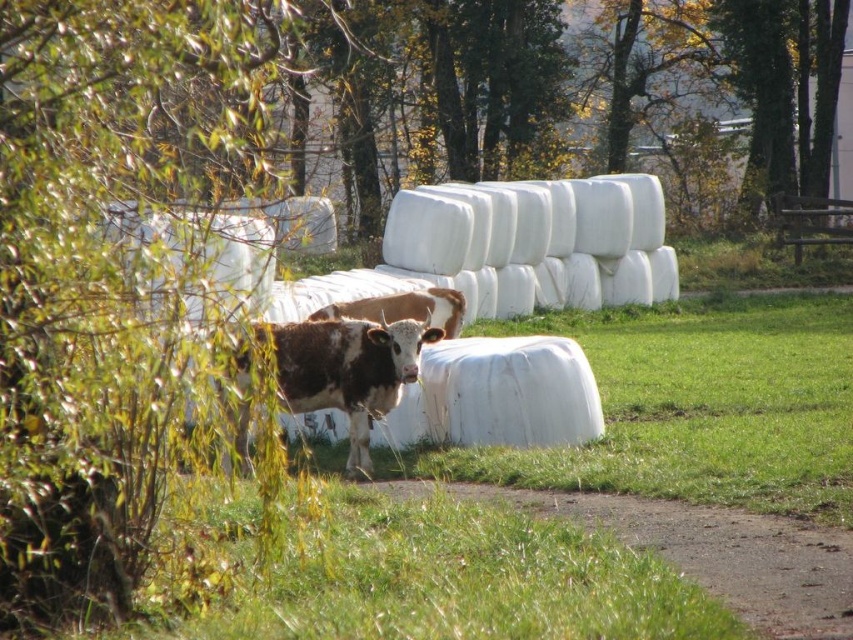
You are standing in the middle of the field looking at the cows and hay bales. There are two points marked on the ground at coordinates point (351,321) and point (460,305). Which point is closer to you?

Point (351,321) is closer to the viewer than point (460,305).

You are a farmer checking the field. You see the brown speckled hide at center and the brown speckled cow at center. Which one is taller?

The brown speckled hide at center is taller than the brown speckled cow at center.